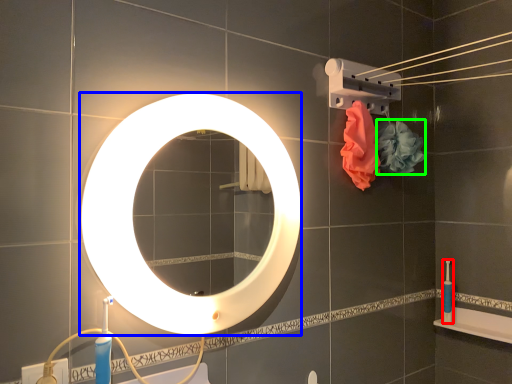
Question: Which object is the farthest from toiletry (highlighted by a red box)? Choose among these: mirror (highlighted by a blue box) or flower (highlighted by a green box).

Choices:
 (A) mirror
 (B) flower

Answer: (A)